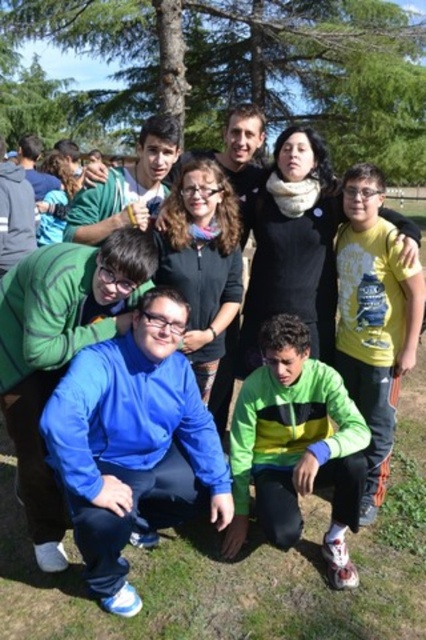
Does green leafy tree at upper center come in front of blue fleece jacket at center?

No, it is not.

Does point (196, 58) come behind point (121, 365)?

Yes, it is behind point (121, 365).

Image resolution: width=426 pixels, height=640 pixels. In order to click on green leafy tree at upper center in this screenshot , I will do `click(230, 70)`.

Does green leafy tree at upper center come in front of green/yellow striped jacket at center?

No.

Can you confirm if green leafy tree at upper center is taller than green/yellow striped jacket at center?

Yes, green leafy tree at upper center is taller than green/yellow striped jacket at center.

Is point (322, 42) in front of point (247, 492)?

No, (322, 42) is further to viewer.

I want to click on green leafy tree at upper center, so click(230, 70).

How distant is blue fleece jacket at center from green/yellow striped jacket at center?

blue fleece jacket at center is 53.34 centimeters from green/yellow striped jacket at center.

Measure the distance between blue fleece jacket at center and green/yellow striped jacket at center.

The distance of blue fleece jacket at center from green/yellow striped jacket at center is 21.00 inches.

Identify the location of blue fleece jacket at center. (132, 444).